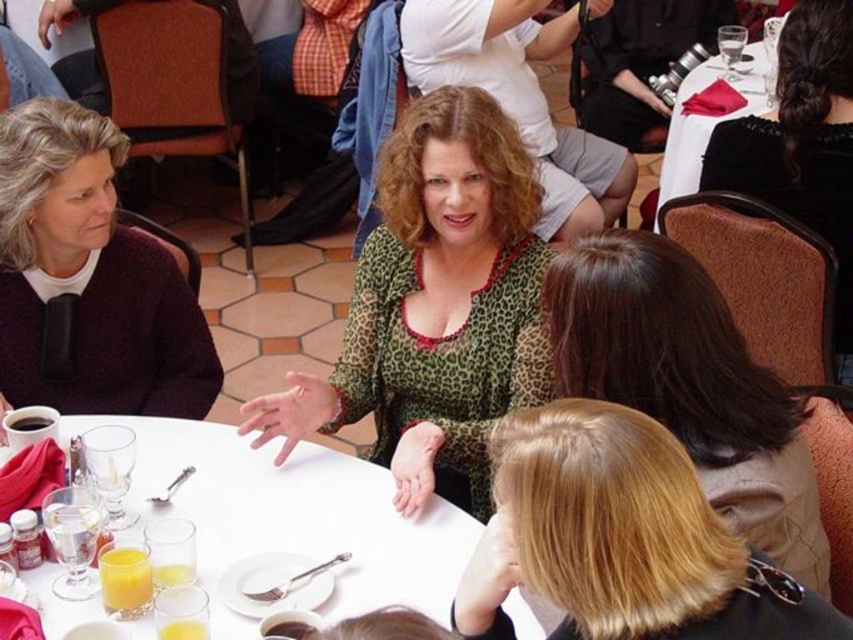
Can you confirm if blonde hair at center is positioned below translucent glass cup at lower left?

No.

Does blonde hair at center appear over translucent glass cup at lower left?

Indeed, blonde hair at center is positioned over translucent glass cup at lower left.

You are a GUI agent. You are given a task and a screenshot of the screen. Output one action in this format:
    pyautogui.click(x=<x>, y=<y>)
    Task: Click on the blonde hair at center
    The width and height of the screenshot is (853, 640).
    Given the screenshot: What is the action you would take?
    pyautogui.click(x=619, y=538)

You are a GUI agent. You are given a task and a screenshot of the screen. Output one action in this format:
    pyautogui.click(x=<x>, y=<y>)
    Task: Click on the blonde hair at center
    The width and height of the screenshot is (853, 640).
    Given the screenshot: What is the action you would take?
    pyautogui.click(x=619, y=538)

Is dark brown hair at upper center closer to camera compared to translucent glass cup at lower left?

That is True.

Is point (788, 451) farther from camera compared to point (132, 582)?

That is False.

The height and width of the screenshot is (640, 853). What are the coordinates of `dark brown hair at upper center` in the screenshot? It's located at coord(688,385).

Is dark brown hair at upper center to the left of white glossy table at center from the viewer's perspective?

Incorrect, dark brown hair at upper center is not on the left side of white glossy table at center.

Measure the distance between dark brown hair at upper center and camera.

The distance of dark brown hair at upper center from camera is 1.20 meters.

The width and height of the screenshot is (853, 640). Identify the location of dark brown hair at upper center. coord(688,385).